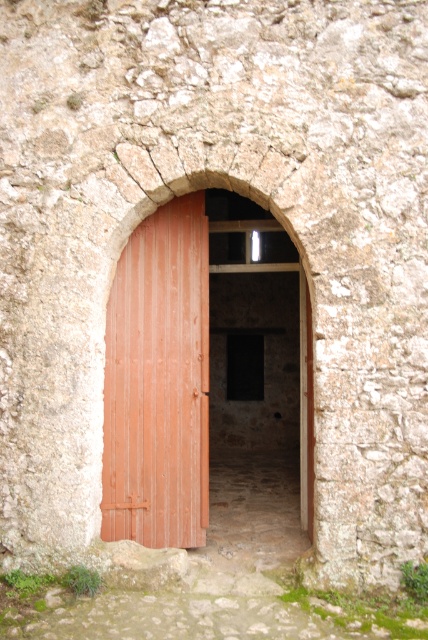
You are standing in front of the arched doorway and want to enter the building. Where exactly is the wooden door at center located in relation to the archway?

The wooden door at center is located at point (x=207, y=374) within the archway.